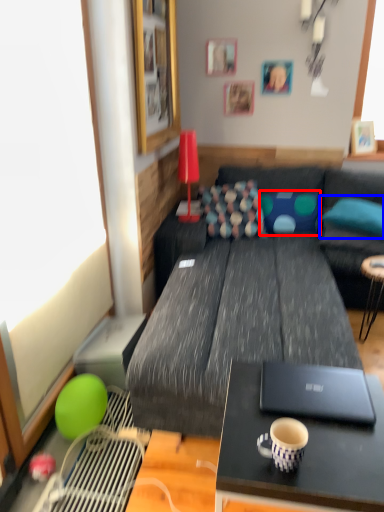
Question: Which of the following is the closest to the observer, pillow (highlighted by a red box) or pillow (highlighted by a blue box)?

Choices:
 (A) pillow
 (B) pillow

Answer: (B)